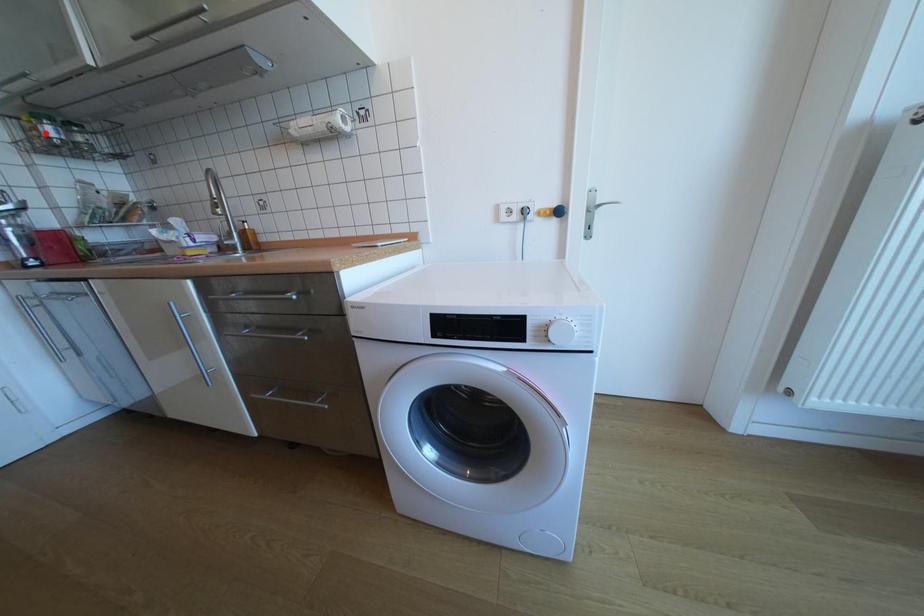
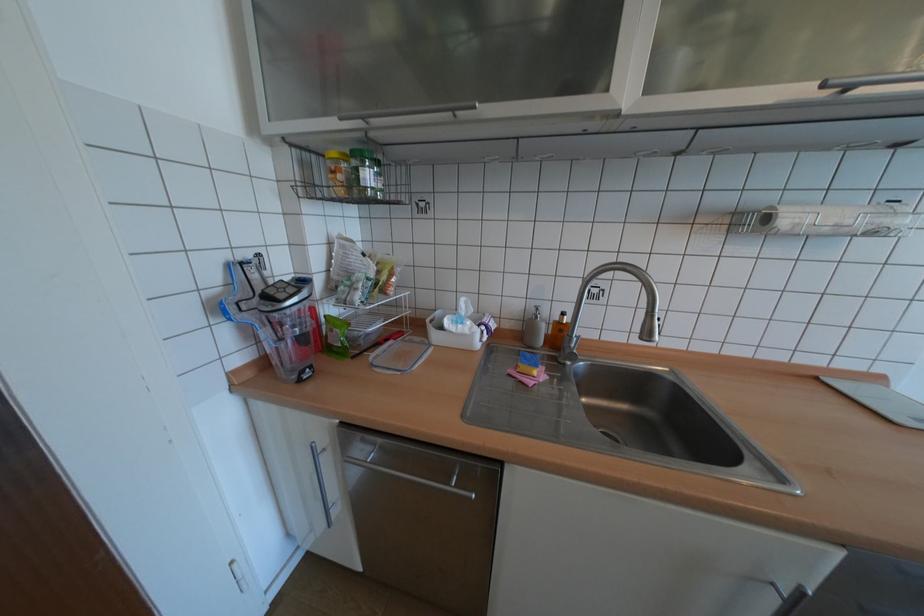
Question: A red point is marked in image1. In image2, is the corresponding 3D point closer to the camera or farther? Reply with the corresponding letter.

Choices:
 (A) The corresponding 3D point is closer.
 (B) The corresponding 3D point is farther.

Answer: (A)